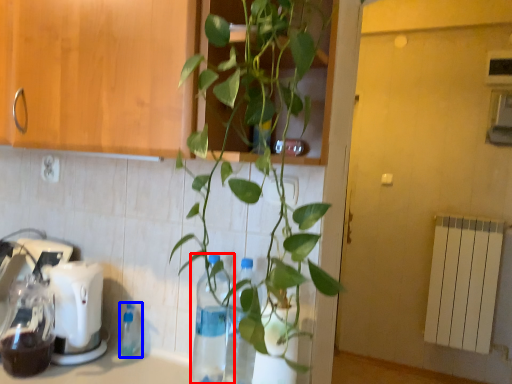
Question: Which object is further to the camera taking this photo, bottle (highlighted by a red box) or bottle (highlighted by a blue box)?

Choices:
 (A) bottle
 (B) bottle

Answer: (B)